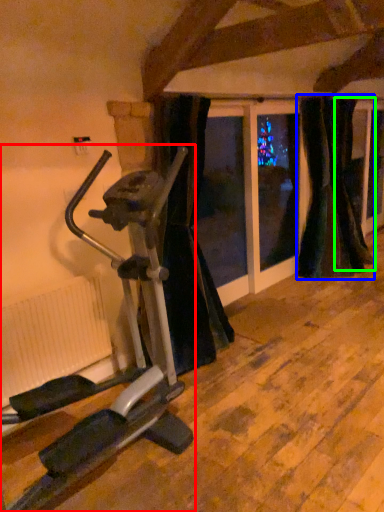
Question: Which object is positioned farthest from stationary bicycle (highlighted by a red box)? Select from curtain (highlighted by a blue box) and curtain (highlighted by a green box).

Choices:
 (A) curtain
 (B) curtain

Answer: (B)